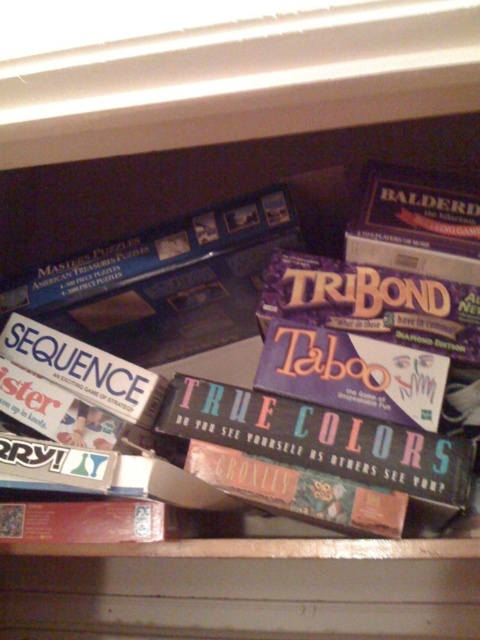
Between matte purple board game at center and matte cardboard true colors at center, which one is positioned lower?

matte cardboard true colors at center is lower down.

Where is `matte purple board game at center`? The height and width of the screenshot is (640, 480). matte purple board game at center is located at coordinates (320, 438).

From the picture: Measure the distance between purple cardboard game at center and camera.

purple cardboard game at center is 29.45 inches away from camera.

Locate an element on the screen. Image resolution: width=480 pixels, height=640 pixels. purple cardboard game at center is located at coordinates (186, 312).

Does point (84, 330) come behind point (267, 490)?

Yes, point (84, 330) is behind point (267, 490).

From the picture: Is purple cardboard game at center closer to the viewer compared to matte cardboard true colors at center?

No.

Find the location of `purple cardboard game at center`. purple cardboard game at center is located at coordinates (186, 312).

Find the location of a particular element. This screenshot has width=480, height=640. purple cardboard game at center is located at coordinates (186, 312).